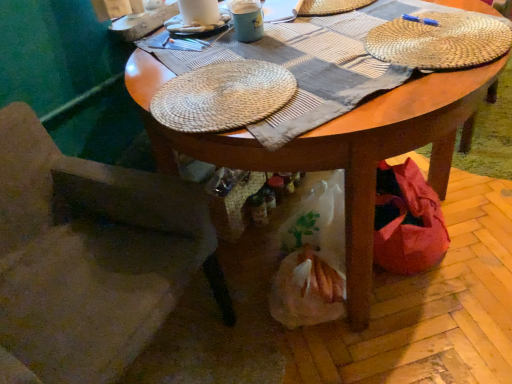
Where is `vacant space underneath woven straw placemat at center, which is the first hat in bottom-to-top order (from a real-world perspective)`? This screenshot has width=512, height=384. vacant space underneath woven straw placemat at center, which is the first hat in bottom-to-top order (from a real-world perspective) is located at coordinates (226, 89).